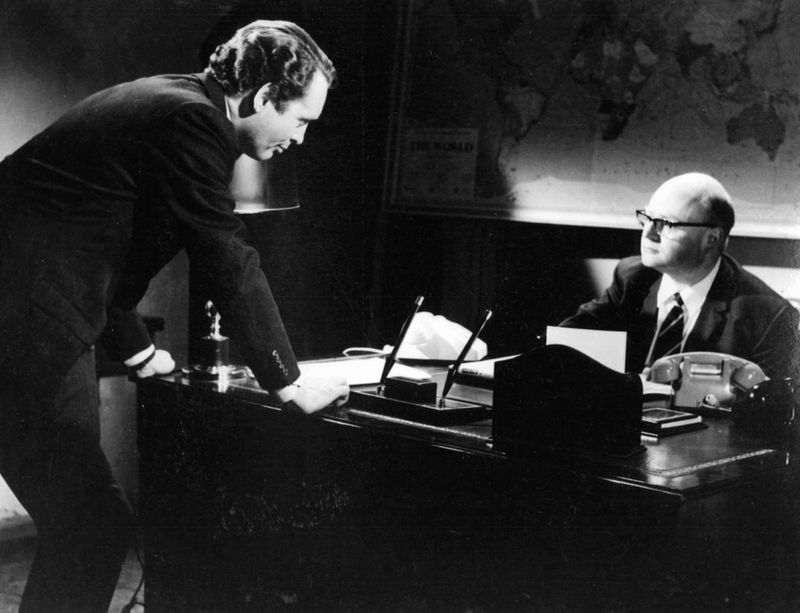
Where is `telephone`? The height and width of the screenshot is (613, 800). telephone is located at coordinates (721, 381).